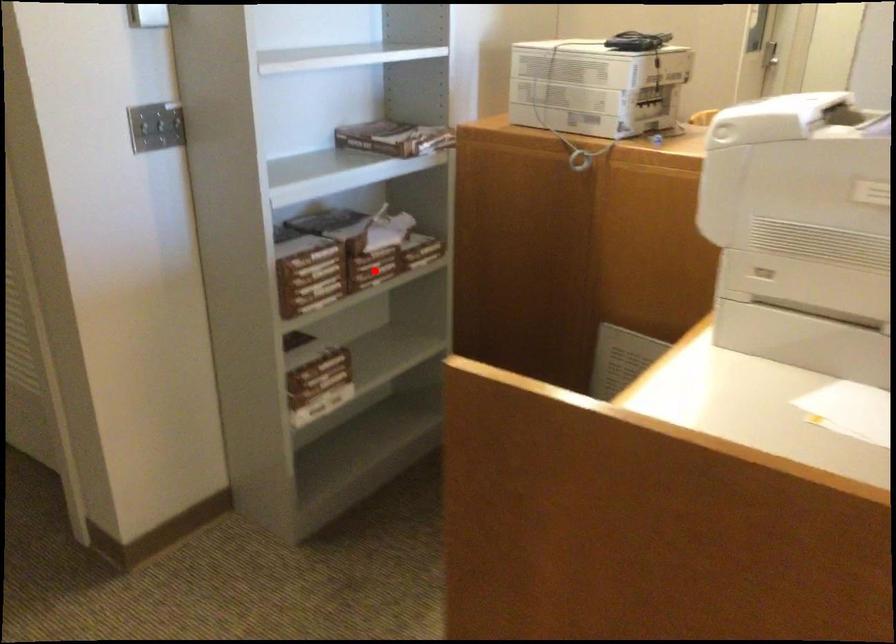
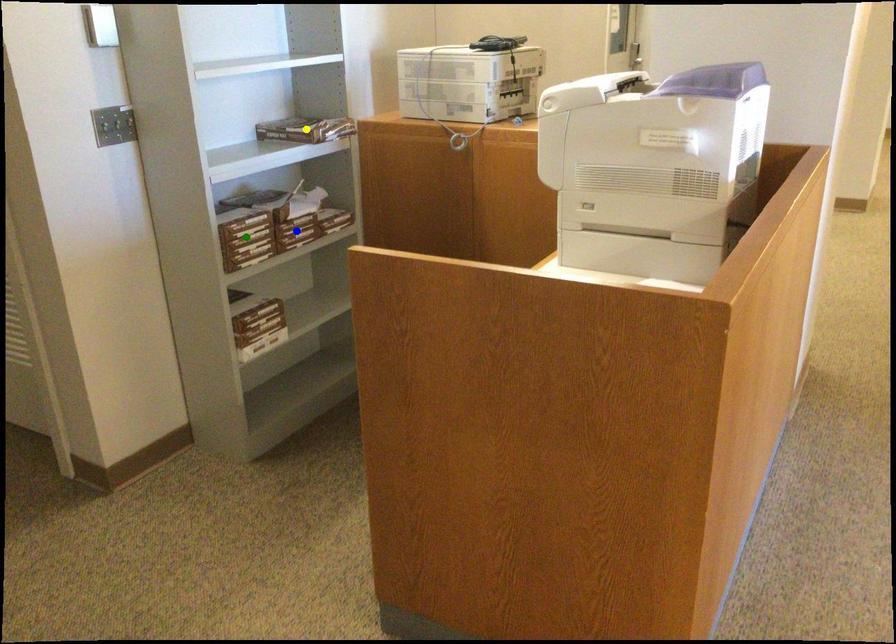
Question: I am providing you with two images of the same scene from different viewpoints. A red point is marked on the first image. You are given multiple points on the second image. Which mark in image 2 goes with the point in image 1?

Choices:
 (A) blue point
 (B) green point
 (C) yellow point

Answer: (A)